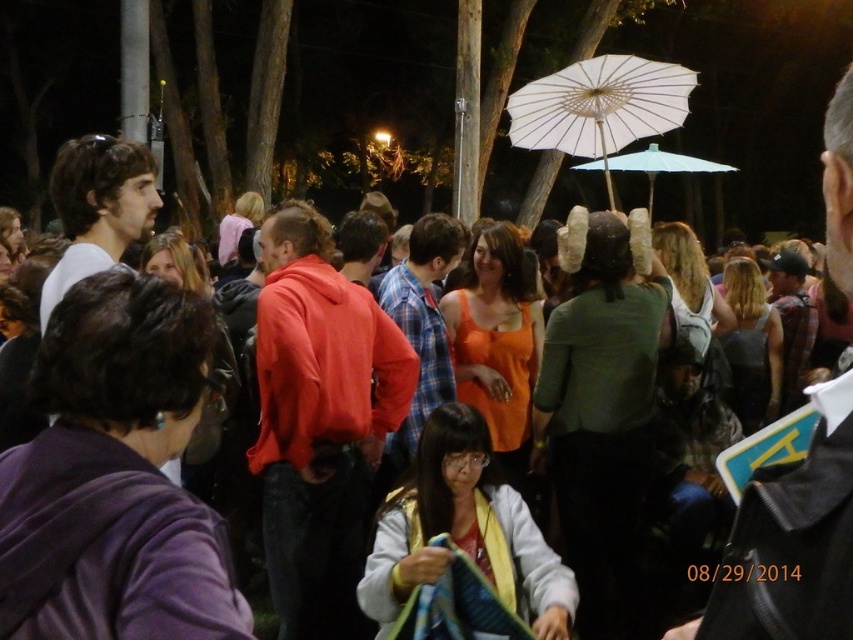
Who is more forward, (374, 460) or (608, 148)?

Point (374, 460)

Locate an element on the screen. matte red hoodie at center is located at coordinates (318, 422).

Is matte white hair at upper left to the left of plaid fabric shirt at center from the viewer's perspective?

Correct, you'll find matte white hair at upper left to the left of plaid fabric shirt at center.

Between point (129, 218) and point (422, 237), which one is positioned in front?

Positioned in front is point (129, 218).

Where is `matte white hair at upper left`? matte white hair at upper left is located at coordinates (97, 208).

Between point (354, 317) and point (685, 161), which one is positioned behind?

Point (685, 161)

Is matte red hoodie at center thinner than blue paper parasol at center?

Indeed, matte red hoodie at center has a lesser width compared to blue paper parasol at center.

This screenshot has height=640, width=853. What do you see at coordinates (318, 422) in the screenshot?
I see `matte red hoodie at center` at bounding box center [318, 422].

Identify the location of matte red hoodie at center. This screenshot has height=640, width=853. (318, 422).